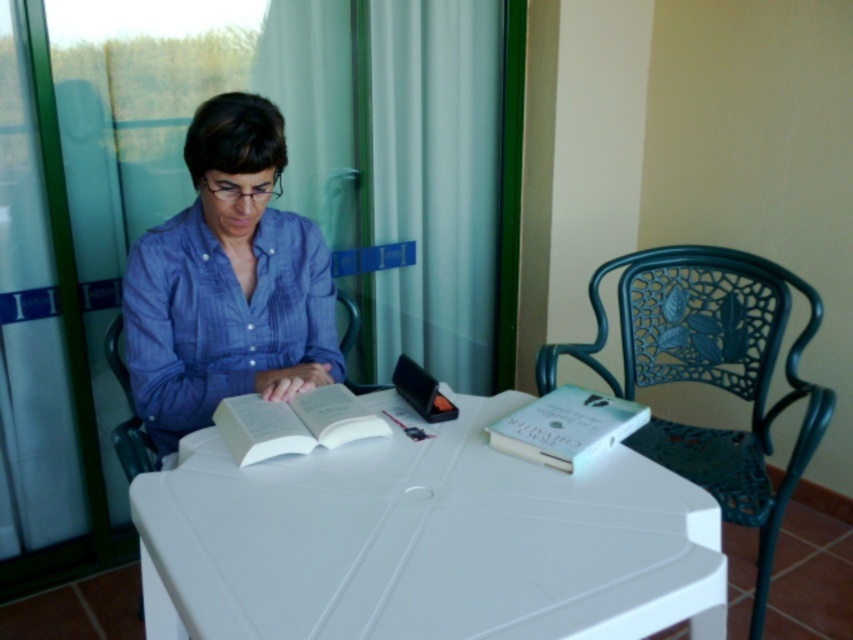
Question: Estimate the real-world distances between objects in this image. Which object is closer to the green wrought iron chair at right?

Choices:
 (A) white plastic table at center
 (B) blue cotton shirt at center
 (C) white sheer curtain at upper center

Answer: (A)

Question: Which of the following is the farthest from the observer?

Choices:
 (A) green wrought iron chair at right
 (B) white sheer curtain at upper center
 (C) transparent glass door at upper left
 (D) blue cotton shirt at center

Answer: (C)

Question: Does white sheer curtain at upper center appear over white matte book at lower right?

Choices:
 (A) yes
 (B) no

Answer: (A)

Question: Is blue cotton shirt at center wider than white matte book at lower right?

Choices:
 (A) no
 (B) yes

Answer: (B)

Question: Which object is positioned farthest from the blue cotton shirt at center?

Choices:
 (A) green wrought iron chair at right
 (B) white sheer curtain at upper center
 (C) white matte book at lower right

Answer: (A)

Question: Can you confirm if white paper book at center is positioned to the left of white matte book at lower right?

Choices:
 (A) no
 (B) yes

Answer: (B)